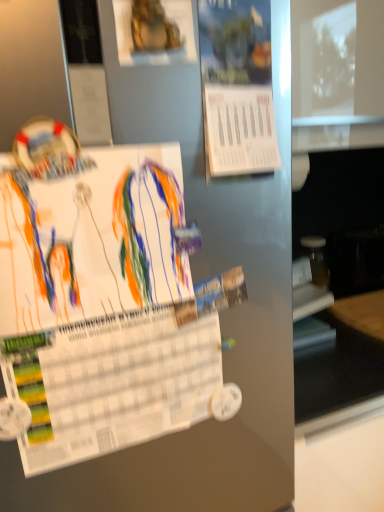
Question: Should I look upward or downward to see white paper at center, positioned as the 3th poster in top-to-bottom order?

Choices:
 (A) up
 (B) down

Answer: (B)

Question: Which direction should I rotate to look at gold metallic statue at upper center, the 1th poster positioned from the top, — up or down?

Choices:
 (A) down
 (B) up

Answer: (B)

Question: Is gold metallic statue at upper center, the 1th poster positioned from the top, closer to the viewer compared to white paper at center, positioned as the 3th poster in top-to-bottom order?

Choices:
 (A) no
 (B) yes

Answer: (A)

Question: Considering the relative positions of gold metallic statue at upper center, marked as the third poster in a bottom-to-top arrangement, and white paper at center, the 1th poster when ordered from bottom to top, in the image provided, is gold metallic statue at upper center, marked as the third poster in a bottom-to-top arrangement, to the left of white paper at center, the 1th poster when ordered from bottom to top, from the viewer's perspective?

Choices:
 (A) no
 (B) yes

Answer: (A)

Question: Does gold metallic statue at upper center, the 1th poster positioned from the top, have a smaller size compared to white paper at center, positioned as the 3th poster in top-to-bottom order?

Choices:
 (A) yes
 (B) no

Answer: (A)

Question: Does gold metallic statue at upper center, marked as the third poster in a bottom-to-top arrangement, have a greater width compared to white paper at center, positioned as the 3th poster in top-to-bottom order?

Choices:
 (A) no
 (B) yes

Answer: (B)

Question: Is gold metallic statue at upper center, the 1th poster positioned from the top, far away from white paper at center, positioned as the 3th poster in top-to-bottom order?

Choices:
 (A) no
 (B) yes

Answer: (A)

Question: Is the position of gold metallic statue at upper center, the 1th poster positioned from the top, more distant than that of white paper at center, positioned as the 3th poster in top-to-bottom order?

Choices:
 (A) no
 (B) yes

Answer: (B)

Question: Is gold metallic statue at upper center, the 1th poster positioned from the top, taller than blue paper at upper center, which appears as the 2th poster when viewed from the top?

Choices:
 (A) no
 (B) yes

Answer: (A)

Question: From a real-world perspective, is gold metallic statue at upper center, marked as the third poster in a bottom-to-top arrangement, physically above blue paper at upper center, which appears as the 2th poster when viewed from the top?

Choices:
 (A) yes
 (B) no

Answer: (A)

Question: Is gold metallic statue at upper center, the 1th poster positioned from the top, positioned beyond the bounds of blue paper at upper center, marked as the 2th poster in a bottom-to-top arrangement?

Choices:
 (A) yes
 (B) no

Answer: (A)

Question: Can you confirm if gold metallic statue at upper center, the 1th poster positioned from the top, is shorter than blue paper at upper center, marked as the 2th poster in a bottom-to-top arrangement?

Choices:
 (A) yes
 (B) no

Answer: (A)

Question: Is gold metallic statue at upper center, marked as the third poster in a bottom-to-top arrangement, aimed at blue paper at upper center, marked as the 2th poster in a bottom-to-top arrangement?

Choices:
 (A) no
 (B) yes

Answer: (A)

Question: Is gold metallic statue at upper center, marked as the third poster in a bottom-to-top arrangement, closer to camera compared to blue paper at upper center, marked as the 2th poster in a bottom-to-top arrangement?

Choices:
 (A) no
 (B) yes

Answer: (B)

Question: Is blue paper at upper center, marked as the 2th poster in a bottom-to-top arrangement, facing towards white paper at center, the 1th poster when ordered from bottom to top?

Choices:
 (A) yes
 (B) no

Answer: (B)